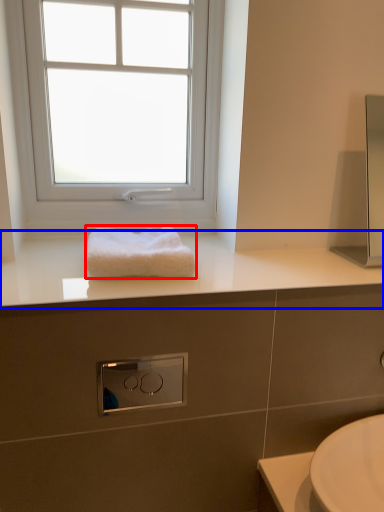
Question: Which point is further to the camera, towel (highlighted by a red box) or countertop (highlighted by a blue box)?

Choices:
 (A) towel
 (B) countertop

Answer: (A)